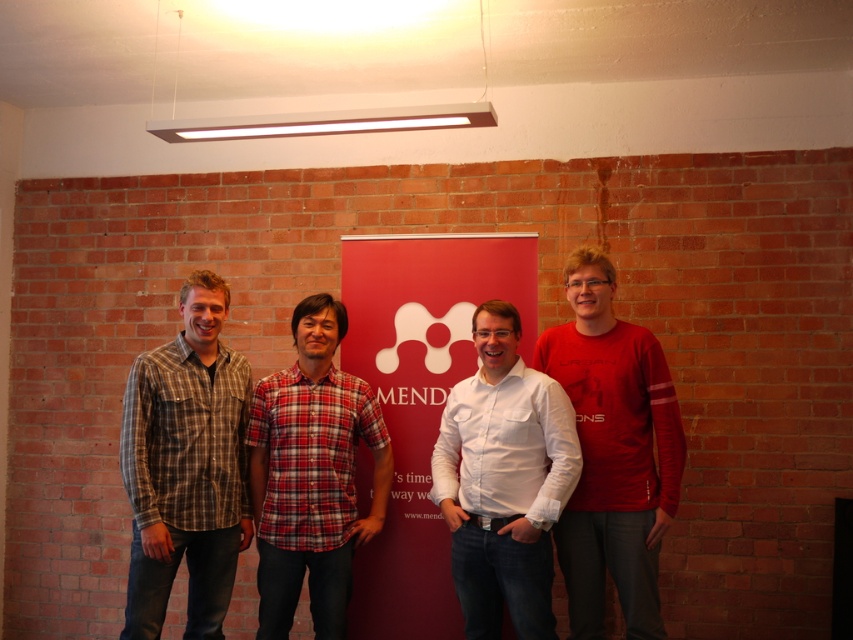
Question: Is plaid flannel shirt at left positioned before red plaid shirt at center?

Choices:
 (A) yes
 (B) no

Answer: (A)

Question: Considering the real-world distances, which object is closest to the plaid flannel shirt at left?

Choices:
 (A) red matte banner at center
 (B) matte red shirt at right

Answer: (A)

Question: Which point is closer to the camera?

Choices:
 (A) (366, 531)
 (B) (614, 470)
 (C) (515, 524)
 (D) (247, 454)

Answer: (C)

Question: Is matte red shirt at right above white cotton shirt at center?

Choices:
 (A) yes
 (B) no

Answer: (A)

Question: Does red matte banner at center have a lesser width compared to white cotton shirt at center?

Choices:
 (A) yes
 (B) no

Answer: (B)

Question: Which object is the closest to the white cotton shirt at center?

Choices:
 (A) matte red shirt at right
 (B) plaid flannel shirt at left

Answer: (A)